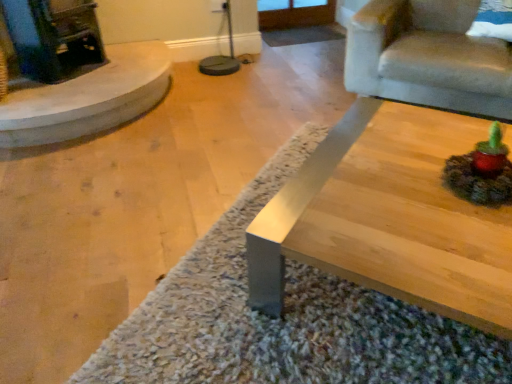
Question: Visually, is velvet beige armchair at upper right positioned to the left or to the right of shaggy carpet at center?

Choices:
 (A) left
 (B) right

Answer: (B)

Question: Considering the positions of velvet beige armchair at upper right and shaggy carpet at center in the image, is velvet beige armchair at upper right taller or shorter than shaggy carpet at center?

Choices:
 (A) tall
 (B) short

Answer: (A)

Question: Which object is positioned farthest from the shaggy carpet at center?

Choices:
 (A) smooth beige fireplace at left
 (B) velvet beige armchair at upper right

Answer: (A)

Question: Estimate the real-world distances between objects in this image. Which object is farther from the smooth beige fireplace at left?

Choices:
 (A) velvet beige armchair at upper right
 (B) shaggy carpet at center

Answer: (A)